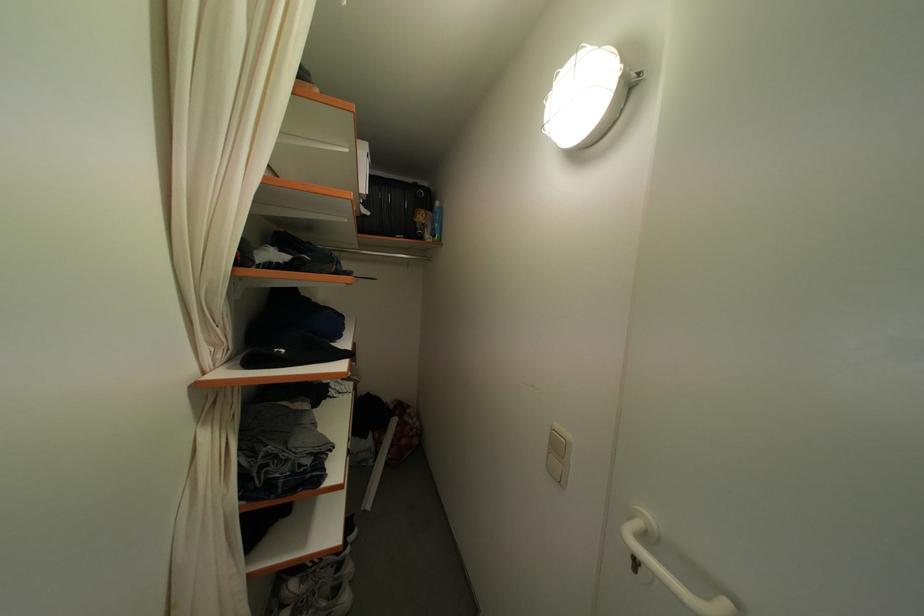
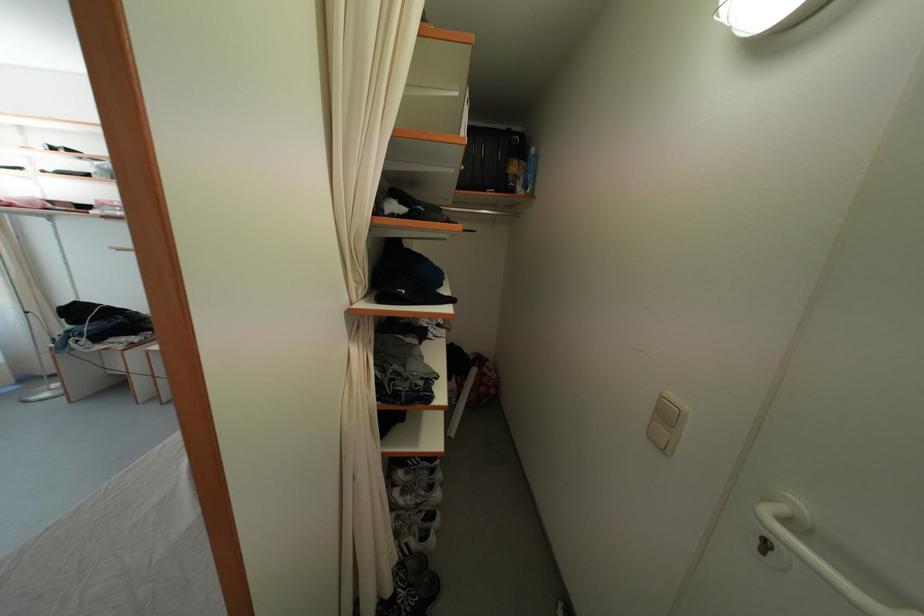
The images are taken continuously from a first-person perspective. In which direction are you moving?

The cameraman walked toward left, backward.